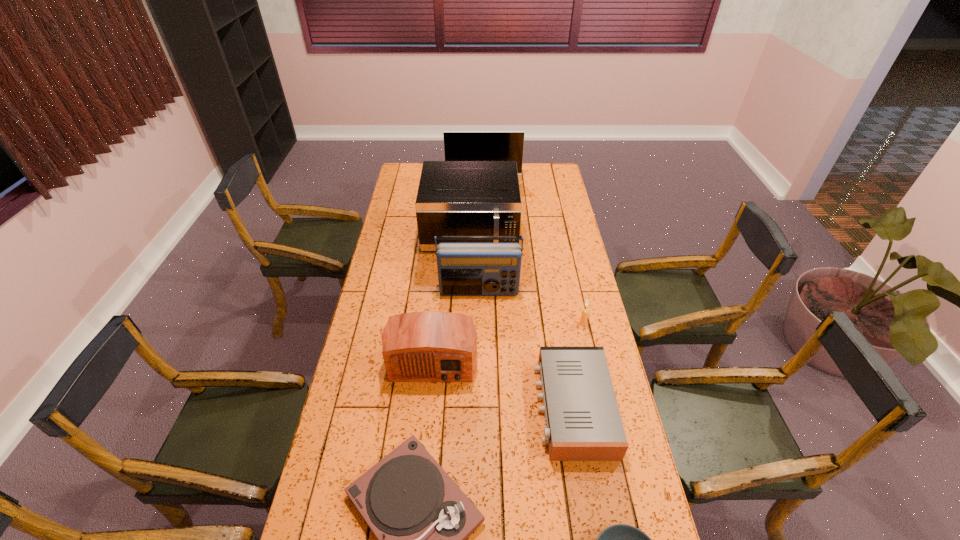
Locate an element on the screen. Image resolution: width=960 pixels, height=540 pixels. radio receiver that is at the right edge is located at coordinates (583, 423).

The width and height of the screenshot is (960, 540). In the image, there is a desktop. Identify the location of free space at the left edge. (373, 423).

The image size is (960, 540). Identify the location of vacant point at the right edge. (587, 485).

In the image, there is a desktop. At what (x,y) coordinates should I click in order to perform the action: click on free space at the far right corner. Please return your answer as a coordinate pair (x, y). Image resolution: width=960 pixels, height=540 pixels. Looking at the image, I should click on (557, 173).

Where is `free space that is in between the third shortest object and the microwave_oven`? This screenshot has width=960, height=540. free space that is in between the third shortest object and the microwave_oven is located at coordinates (521, 320).

Identify the location of unoccupied position between the third farthest object and the candle. (531, 308).

The width and height of the screenshot is (960, 540). I want to click on vacant space in between the sixth nearest object and the candle, so click(531, 308).

Select which object is the fifth closest to the monitor. Please provide its 2D coordinates. Your answer should be formatted as a tuple, i.e. [(x, y)], where the tuple contains the x and y coordinates of a point satisfying the conditions above.

[(583, 423)]

At what (x,y) coordinates should I click in order to perform the action: click on object that ranks as the seventh closest to the candle. Please return your answer as a coordinate pair (x, y). This screenshot has height=540, width=960. Looking at the image, I should click on (458, 145).

This screenshot has width=960, height=540. Find the location of `radio receiver that is the closest to the soup bowl`. radio receiver that is the closest to the soup bowl is located at coordinates (583, 423).